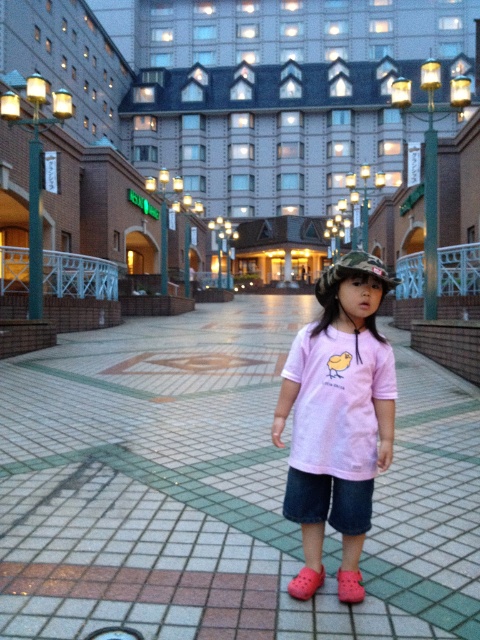
Question: From the image, what is the correct spatial relationship of pink matte shirt at center in relation to pink croc shoes at lower center?

Choices:
 (A) above
 (B) below

Answer: (A)

Question: Is pink matte shirt at center below pink rubber shoe at lower center?

Choices:
 (A) yes
 (B) no

Answer: (B)

Question: Among these objects, which one is farthest from the camera?

Choices:
 (A) pink tile pavement at center
 (B) denim shorts at center

Answer: (B)

Question: Is pink cotton shirt at center positioned at the back of pink matte shirt at center?

Choices:
 (A) no
 (B) yes

Answer: (B)

Question: Based on their relative distances, which object is nearer to the pink rubber shoe at lower center?

Choices:
 (A) denim shorts at center
 (B) pink tile pavement at center
 (C) pink croc shoes at lower center

Answer: (C)

Question: Which point is closer to the camera?

Choices:
 (A) pink tile pavement at center
 (B) denim shorts at center

Answer: (A)